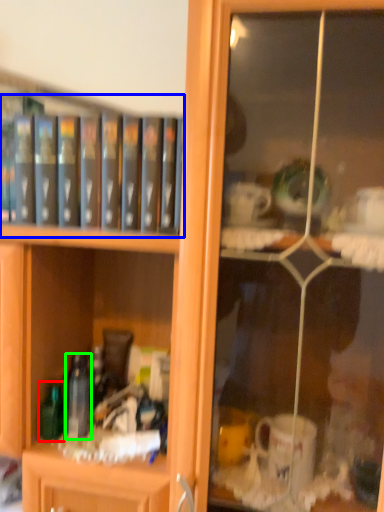
Question: Which object is positioned closest to bottle (highlighted by a red box)? Select from book (highlighted by a blue box) and bottle (highlighted by a green box).

Choices:
 (A) book
 (B) bottle

Answer: (B)